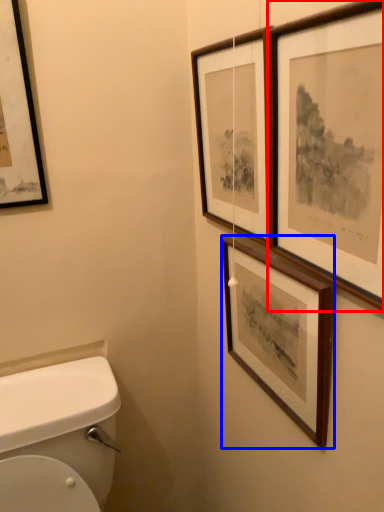
Question: Which object appears farthest to the camera in this image, picture frame (highlighted by a red box) or picture frame (highlighted by a blue box)?

Choices:
 (A) picture frame
 (B) picture frame

Answer: (B)